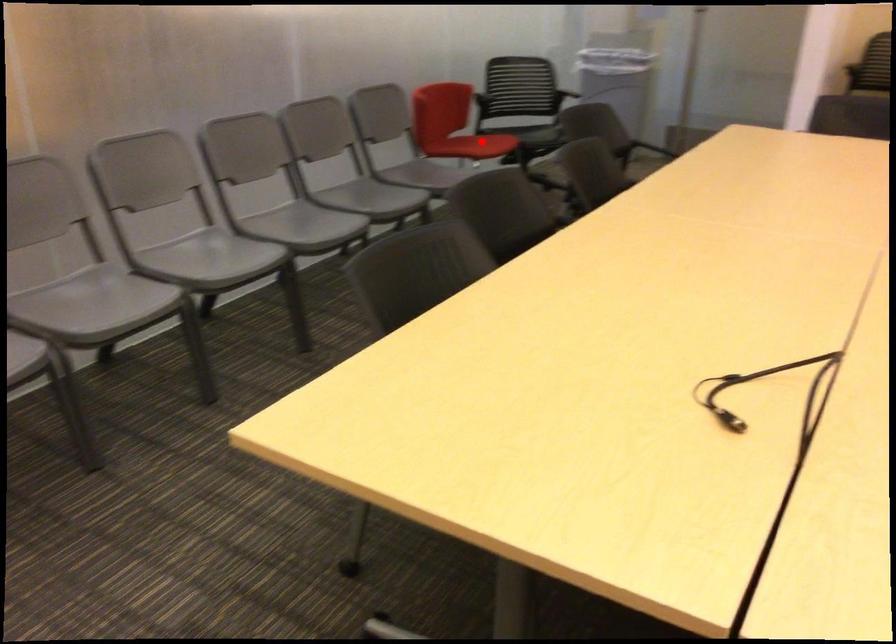
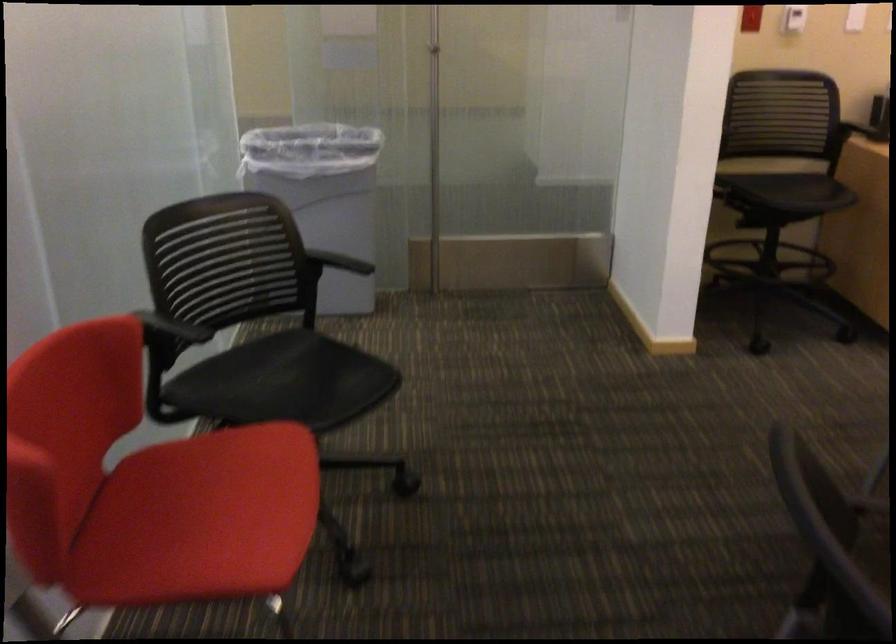
Where in the second image is the point corresponding to the highlighted location from the first image?

(200, 518)